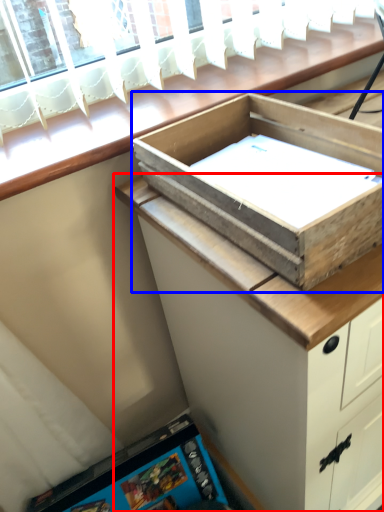
Question: Which object appears farthest to the camera in this image, cabinetry (highlighted by a red box) or box (highlighted by a blue box)?

Choices:
 (A) cabinetry
 (B) box

Answer: (A)